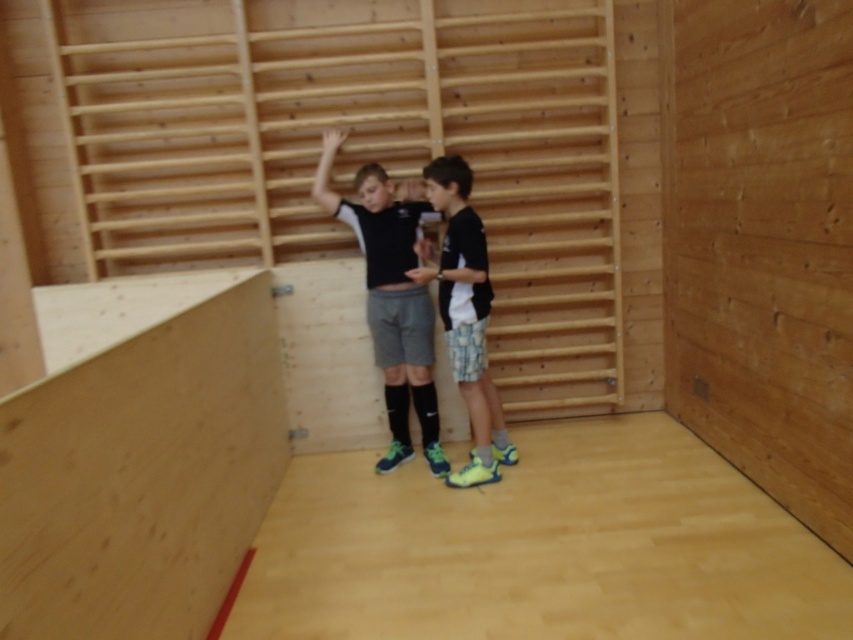
Question: Is light brown wood ramp at lower left below black matte shorts at center?

Choices:
 (A) yes
 (B) no

Answer: (A)

Question: Which of the following is the farthest from the observer?

Choices:
 (A) black matte shorts at center
 (B) light brown wood ramp at lower left

Answer: (A)

Question: Is light brown wood ramp at lower left bigger than black matte shirt at center?

Choices:
 (A) no
 (B) yes

Answer: (B)

Question: Among these objects, which one is farthest from the camera?

Choices:
 (A) light brown wood ramp at lower left
 (B) black matte shorts at center
 (C) black matte shirt at center

Answer: (B)

Question: Based on their relative distances, which object is nearer to the black matte shorts at center?

Choices:
 (A) light brown wood ramp at lower left
 (B) black matte shirt at center

Answer: (B)

Question: Does black matte shorts at center have a greater width compared to black matte shirt at center?

Choices:
 (A) yes
 (B) no

Answer: (A)